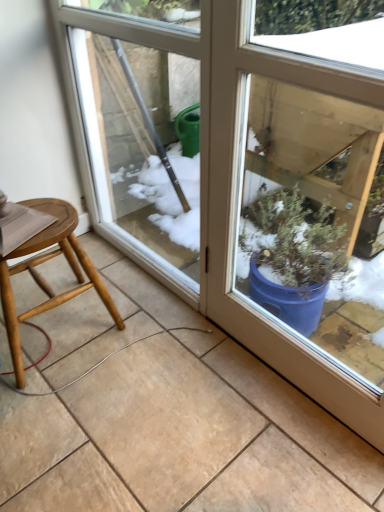
Describe the element at coordinates (131, 123) in the screenshot. I see `transparent glass screen door at center` at that location.

Measure the distance between transparent glass screen door at center and camera.

A distance of 3.39 feet exists between transparent glass screen door at center and camera.

What are the coordinates of `transparent glass screen door at center` in the screenshot? It's located at (131, 123).

The height and width of the screenshot is (512, 384). Describe the element at coordinates (43, 278) in the screenshot. I see `light wood stool at lower left` at that location.

You are a GUI agent. You are given a task and a screenshot of the screen. Output one action in this format:
    pyautogui.click(x=<x>, y=<y>)
    Task: Click on the light wood stool at lower left
    This screenshot has height=512, width=384.
    Given the screenshot: What is the action you would take?
    pyautogui.click(x=43, y=278)

You are a GUI agent. You are given a task and a screenshot of the screen. Output one action in this format:
    pyautogui.click(x=<x>, y=<y>)
    Task: Click on the transparent glass screen door at center
    Image resolution: width=384 pixels, height=512 pixels.
    Given the screenshot: What is the action you would take?
    pyautogui.click(x=131, y=123)

Does light wood stool at lower left appear on the right side of transparent glass screen door at center?

No, light wood stool at lower left is not to the right of transparent glass screen door at center.

Who is more distant, light wood stool at lower left or transparent glass screen door at center?

Answer: light wood stool at lower left is further away from the camera.

Which is farther, (x=48, y=202) or (x=104, y=96)?

Positioned behind is point (x=104, y=96).

From the image's perspective, is light wood stool at lower left positioned above or below transparent glass screen door at center?

light wood stool at lower left is situated lower than transparent glass screen door at center in the image.

From a real-world perspective, which is physically above, light wood stool at lower left or transparent glass screen door at center?

From a 3D spatial view, transparent glass screen door at center is above.

Looking at this image, can you confirm if light wood stool at lower left is thinner than transparent glass screen door at center?

No.

Considering the relative sizes of light wood stool at lower left and transparent glass screen door at center in the image provided, is light wood stool at lower left taller than transparent glass screen door at center?

No, light wood stool at lower left is not taller than transparent glass screen door at center.

Does light wood stool at lower left have a smaller size compared to transparent glass screen door at center?

Indeed, light wood stool at lower left has a smaller size compared to transparent glass screen door at center.

Is light wood stool at lower left situated inside transparent glass screen door at center or outside?

light wood stool at lower left is outside transparent glass screen door at center.

Can you see light wood stool at lower left touching transparent glass screen door at center?

No, light wood stool at lower left is not touching transparent glass screen door at center.

Is light wood stool at lower left facing away from transparent glass screen door at center?

No, light wood stool at lower left is not facing the opposite direction of transparent glass screen door at center.

From the picture: How many degrees apart are the facing directions of light wood stool at lower left and transparent glass screen door at center?

They differ by 87.2 degrees in their facing directions.

What are the coordinates of `stool lying on the left of transparent glass screen door at center` in the screenshot? It's located at (43, 278).

In the image, is transparent glass screen door at center on the left side or the right side of light wood stool at lower left?

Clearly, transparent glass screen door at center is on the right of light wood stool at lower left in the image.

Is transparent glass screen door at center further to the viewer compared to light wood stool at lower left?

No, transparent glass screen door at center is closer to the camera.

Considering the points (101, 166) and (24, 317), which point is behind, point (101, 166) or point (24, 317)?

The point (101, 166) is more distant.

Looking at this image, from the image's perspective, relative to light wood stool at lower left, is transparent glass screen door at center above or below?

transparent glass screen door at center is situated higher than light wood stool at lower left in the image.

From a real-world perspective, which object rests below the other?

In real-world perspective, light wood stool at lower left is lower.

Can you confirm if transparent glass screen door at center is thinner than light wood stool at lower left?

Yes, transparent glass screen door at center is thinner than light wood stool at lower left.

Between transparent glass screen door at center and light wood stool at lower left, which one has more height?

transparent glass screen door at center.

Looking at this image, which of these two, transparent glass screen door at center or light wood stool at lower left, is bigger?

transparent glass screen door at center is bigger.

Is transparent glass screen door at center outside of light wood stool at lower left?

transparent glass screen door at center lies outside light wood stool at lower left's area.

Is transparent glass screen door at center positioned far away from light wood stool at lower left?

They are positioned close to each other.

Is transparent glass screen door at center turned away from light wood stool at lower left?

No, transparent glass screen door at center is not facing the opposite direction of light wood stool at lower left.

How different are the orientations of transparent glass screen door at center and light wood stool at lower left in degrees?

The angular difference between transparent glass screen door at center and light wood stool at lower left is 87.2 degrees.

How distant is transparent glass screen door at center from light wood stool at lower left?

A distance of 19.21 inches exists between transparent glass screen door at center and light wood stool at lower left.

Image resolution: width=384 pixels, height=512 pixels. In order to click on screen door located on the right of light wood stool at lower left in this screenshot , I will do `click(131, 123)`.

The height and width of the screenshot is (512, 384). I want to click on stool that is under the transparent glass screen door at center (from a real-world perspective), so click(x=43, y=278).

This screenshot has width=384, height=512. Identify the location of screen door positioned vertically above the light wood stool at lower left (from a real-world perspective). (131, 123).